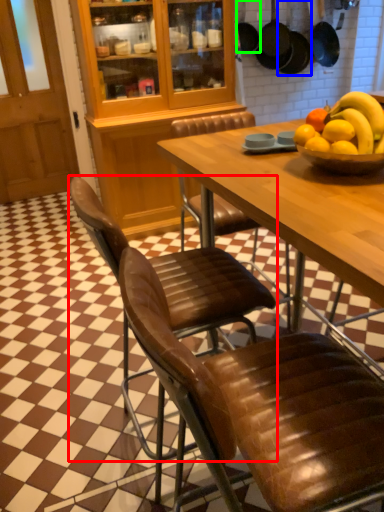
Question: Based on their relative distances, which object is nearer to chair (highlighted by a red box)? Choose from frying pan (highlighted by a blue box) and frying pan (highlighted by a green box).

Choices:
 (A) frying pan
 (B) frying pan

Answer: (B)